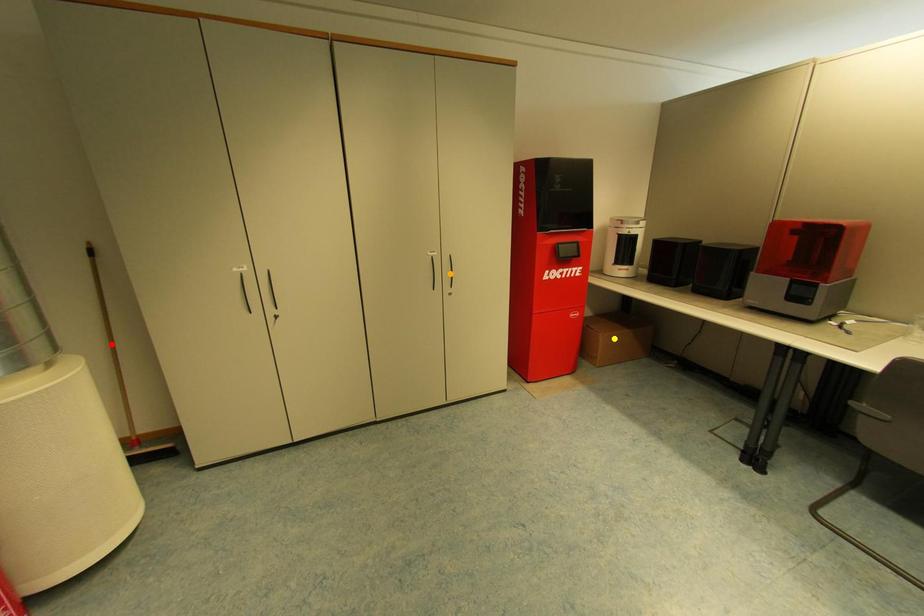
Order these from nearest to farthest:
red point, orange point, yellow point

red point → orange point → yellow point